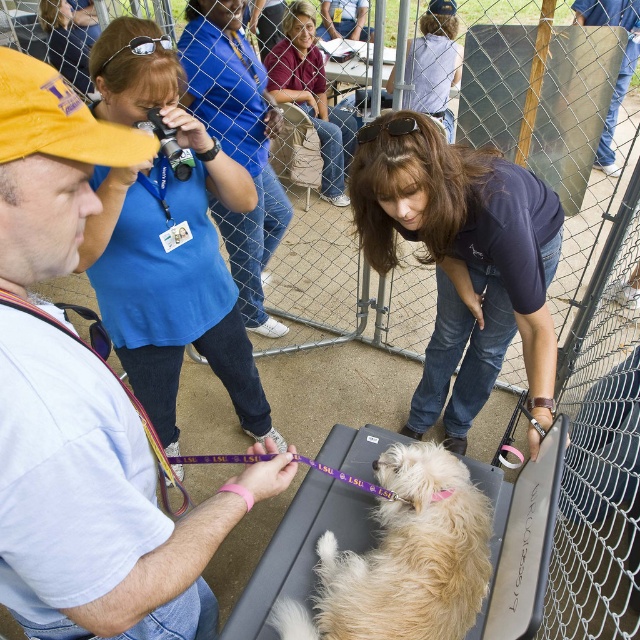
Question: Is light blue shirt at left wider than matte purple shirt at upper center?

Choices:
 (A) yes
 (B) no

Answer: (B)

Question: Which object appears farthest from the camera in this image?

Choices:
 (A) light blue shirt at left
 (B) matte purple shirt at upper center
 (C) blue shirt at upper left

Answer: (B)

Question: Does dark blue shirt at center have a lesser width compared to matte blue shirt at upper center?

Choices:
 (A) yes
 (B) no

Answer: (A)

Question: Estimate the real-world distances between objects in this image. Which object is closer to the fluffy white dog at center?

Choices:
 (A) matte purple shirt at upper center
 (B) matte blue shirt at upper center
 (C) light blue shirt at left

Answer: (C)

Question: Among these points, which one is farthest from the camera?

Choices:
 (A) (38, 547)
 (B) (442, 115)
 (C) (417, 611)

Answer: (B)

Question: Can you confirm if light blue shirt at left is positioned below matte purple shirt at upper center?

Choices:
 (A) yes
 (B) no

Answer: (A)